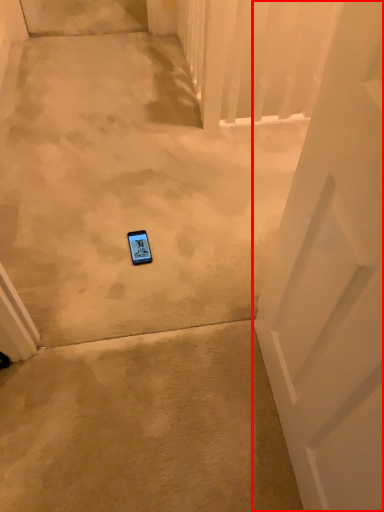
Question: From the image, what is the correct spatial relationship of door (annotated by the red box) in relation to gadget?

Choices:
 (A) right
 (B) left

Answer: (A)